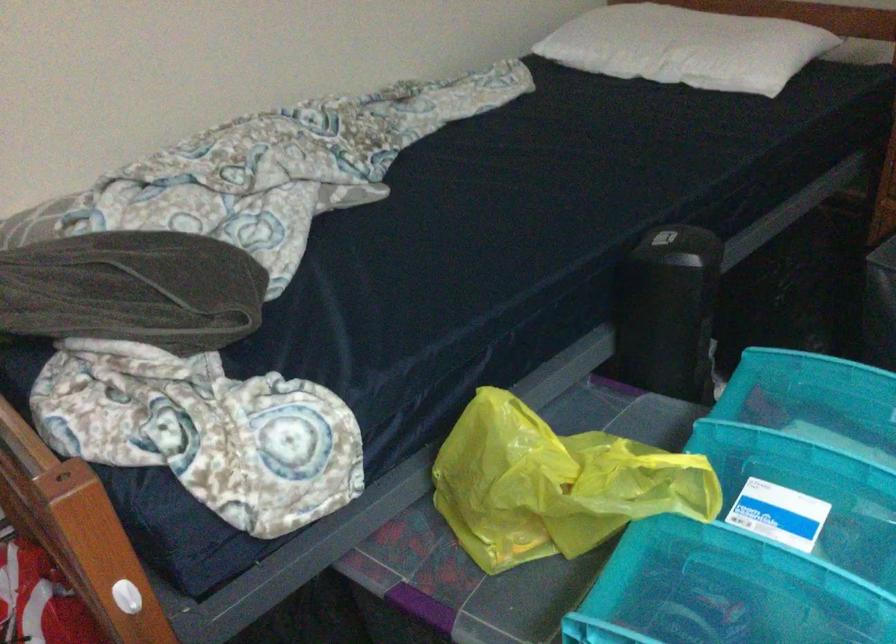
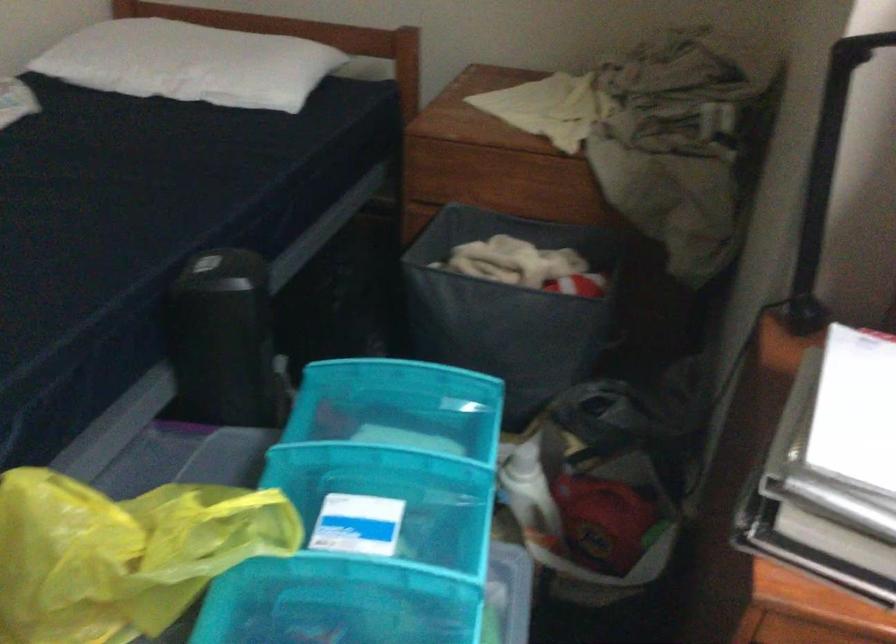
Locate, in the second image, the point that corresponds to (810,450) in the first image.

(376, 451)